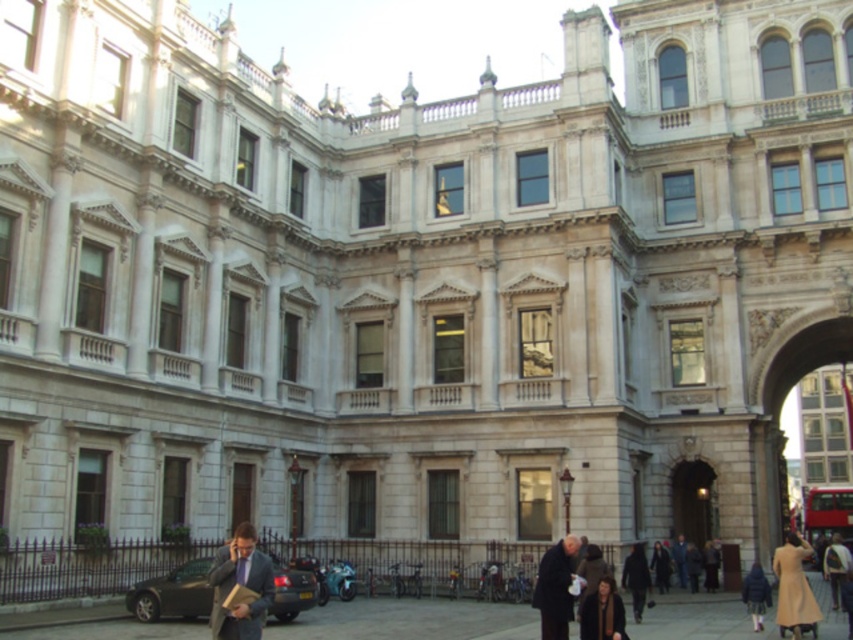
You are standing at the center of the courtyard in front of the historic building. You need to locate the matte black suit at lower left. Based on the coordinates provided, in which general direction should you look to find it?

The matte black suit at lower left is located at coordinates point (x=241, y=586), so you should look to your lower left direction to find it.